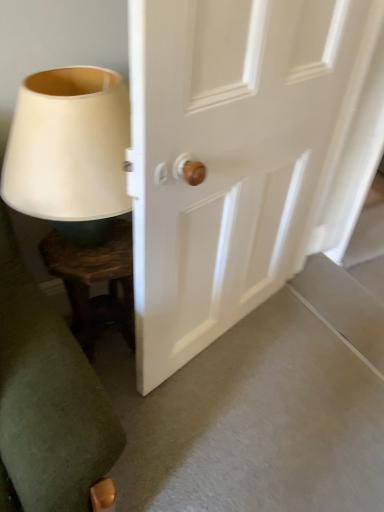
Question: From a real-world perspective, is matte white lampshade at left positioned under dark wood side table at lower left based on gravity?

Choices:
 (A) no
 (B) yes

Answer: (A)

Question: Is the depth of matte white lampshade at left greater than that of dark wood side table at lower left?

Choices:
 (A) yes
 (B) no

Answer: (B)

Question: Is matte white lampshade at left positioned with its back to dark wood side table at lower left?

Choices:
 (A) yes
 (B) no

Answer: (B)

Question: Can you confirm if matte white lampshade at left is thinner than dark wood side table at lower left?

Choices:
 (A) yes
 (B) no

Answer: (B)

Question: Is matte white lampshade at left closer to the viewer compared to dark wood side table at lower left?

Choices:
 (A) no
 (B) yes

Answer: (B)

Question: Can dark wood side table at lower left be found inside matte white lampshade at left?

Choices:
 (A) yes
 (B) no

Answer: (B)

Question: From the image's perspective, would you say matte white lampshade at left is shown under white wooden door at center?

Choices:
 (A) yes
 (B) no

Answer: (B)

Question: Is matte white lampshade at left smaller than white wooden door at center?

Choices:
 (A) yes
 (B) no

Answer: (A)

Question: Is white wooden door at center at the back of matte white lampshade at left?

Choices:
 (A) yes
 (B) no

Answer: (B)

Question: Is matte white lampshade at left aimed at white wooden door at center?

Choices:
 (A) no
 (B) yes

Answer: (A)

Question: Are matte white lampshade at left and white wooden door at center located far from each other?

Choices:
 (A) no
 (B) yes

Answer: (A)

Question: Considering the relative sizes of matte white lampshade at left and white wooden door at center in the image provided, is matte white lampshade at left wider than white wooden door at center?

Choices:
 (A) no
 (B) yes

Answer: (B)

Question: Can you confirm if dark wood side table at lower left is shorter than matte white lampshade at left?

Choices:
 (A) yes
 (B) no

Answer: (B)